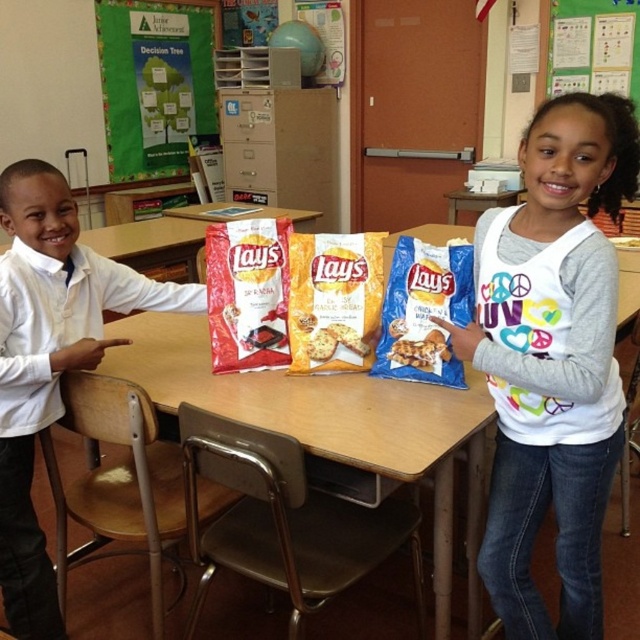
You are a student in the classroom and want to hang a new poster. You need to decide between placing it on the wooden table at center or the green paper at upper center. Which location allows you to place the poster to the right of the other object?

The wooden table at center is to the left of the green paper at upper center, so placing the poster to the right of the wooden table at center would mean placing it on the green paper at upper center.

Looking at this image, in the classroom scene, there are two boys wearing white shirts. One is the white soft shirt at upper right and the other is the white matte shirt at left. Which boy is positioned more to the right side of the image?

The white soft shirt at upper right is positioned more to the right side of the image compared to the white matte shirt at left.